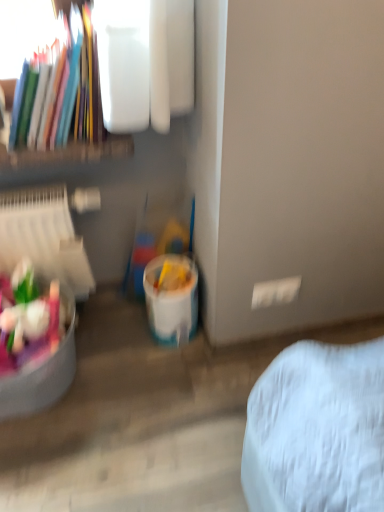
What are the coordinates of `empty space that is to the right of matte plastic toys at lower left` in the screenshot? It's located at (115, 377).